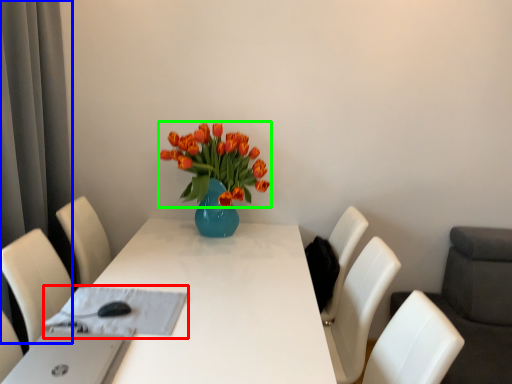
Question: Which object is positioned closest to cloth (highlighted by a red box)? Select from curtain (highlighted by a blue box) and flower (highlighted by a green box).

Choices:
 (A) curtain
 (B) flower

Answer: (B)